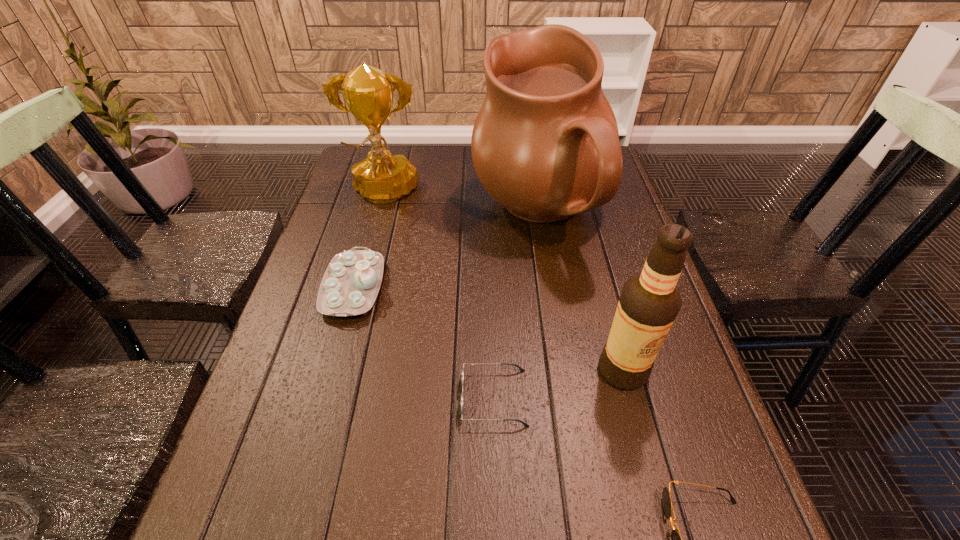
Find the location of `unoccupied area between the alcohol and the cream pitcher`. unoccupied area between the alcohol and the cream pitcher is located at coordinates (581, 292).

You are a GUI agent. You are given a task and a screenshot of the screen. Output one action in this format:
    pyautogui.click(x=<x>, y=<y>)
    Task: Click on the free space between the fourth tallest object and the farther sunglasses
    
    Given the screenshot: What is the action you would take?
    pyautogui.click(x=424, y=342)

You are a GUI agent. You are given a task and a screenshot of the screen. Output one action in this format:
    pyautogui.click(x=<x>, y=<y>)
    Task: Click on the closest object relative to the farther sunglasses
    
    Given the screenshot: What is the action you would take?
    pyautogui.click(x=650, y=301)

Where is `object that stands as the fifth closest to the award`? object that stands as the fifth closest to the award is located at coordinates (676, 539).

In order to click on free region that satisfies the following two spatial constraints: 1. on the label of the alcohol; 2. on the front-facing side of the farther sunglasses in this screenshot , I will do `click(631, 397)`.